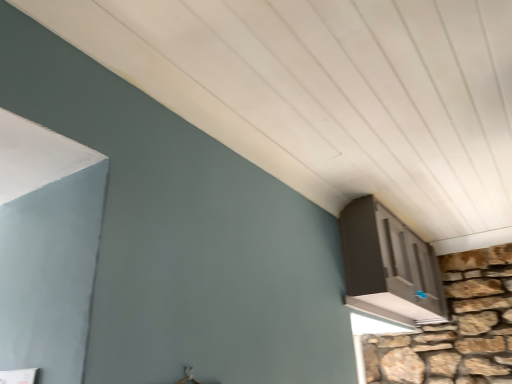
Where is `matte gray cabinet at upper right`? This screenshot has width=512, height=384. matte gray cabinet at upper right is located at coordinates (389, 265).

Measure the distance between point (414, 273) and camera.

The depth of point (414, 273) is 8.30 feet.

Describe the element at coordinates (389, 265) in the screenshot. I see `matte gray cabinet at upper right` at that location.

Measure the distance between matte gray cabinet at upper right and camera.

They are 6.72 feet apart.

At what (x,y) coordinates should I click in order to perform the action: click on matte gray cabinet at upper right. Please return your answer as a coordinate pair (x, y). The width and height of the screenshot is (512, 384). Looking at the image, I should click on (389, 265).